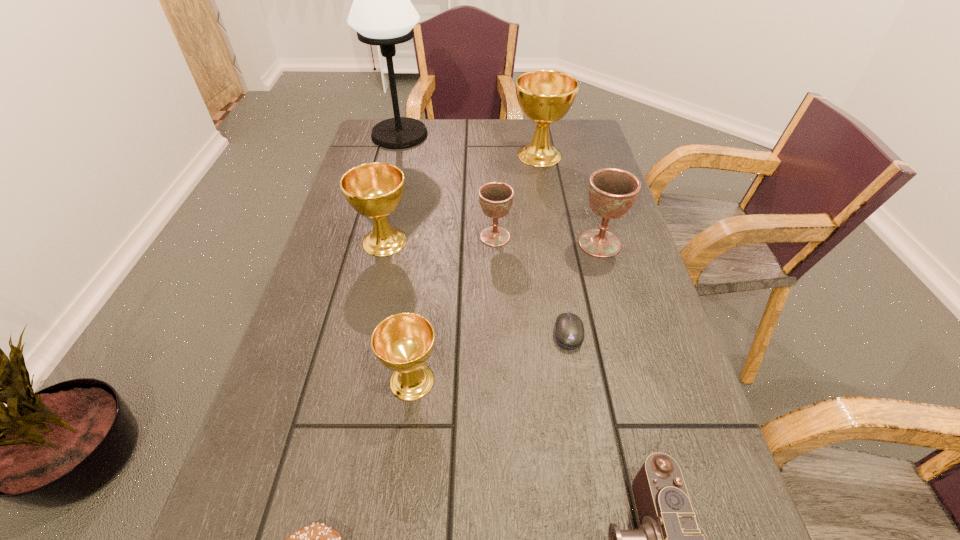
This screenshot has width=960, height=540. I want to click on black table lamp, so click(x=382, y=14).

At what (x,y) coordinates should I click in order to perform the action: click on table lamp. Please return your answer as a coordinate pair (x, y). The image size is (960, 540). Looking at the image, I should click on (382, 14).

Where is `the rightmost gold chalice`? The height and width of the screenshot is (540, 960). the rightmost gold chalice is located at coordinates (545, 96).

Image resolution: width=960 pixels, height=540 pixels. Find the location of `the farthest chalice`. the farthest chalice is located at coordinates (545, 96).

What are the coordinates of `the second biggest gold chalice` in the screenshot? It's located at (374, 190).

At what (x,y) coordinates should I click in order to perform the action: click on the right brown chalice. Please return your answer as a coordinate pair (x, y). This screenshot has height=540, width=960. Looking at the image, I should click on (612, 192).

What are the coordinates of `the left brown chalice` in the screenshot? It's located at (496, 198).

Locate an element on the screen. This screenshot has width=960, height=540. the fifth object from right to left is located at coordinates (496, 198).

This screenshot has width=960, height=540. I want to click on the smallest gold chalice, so click(403, 342).

At what (x,y) coordinates should I click in order to perform the action: click on the third nearest object. Please return your answer as a coordinate pair (x, y). The image size is (960, 540). Looking at the image, I should click on (403, 342).